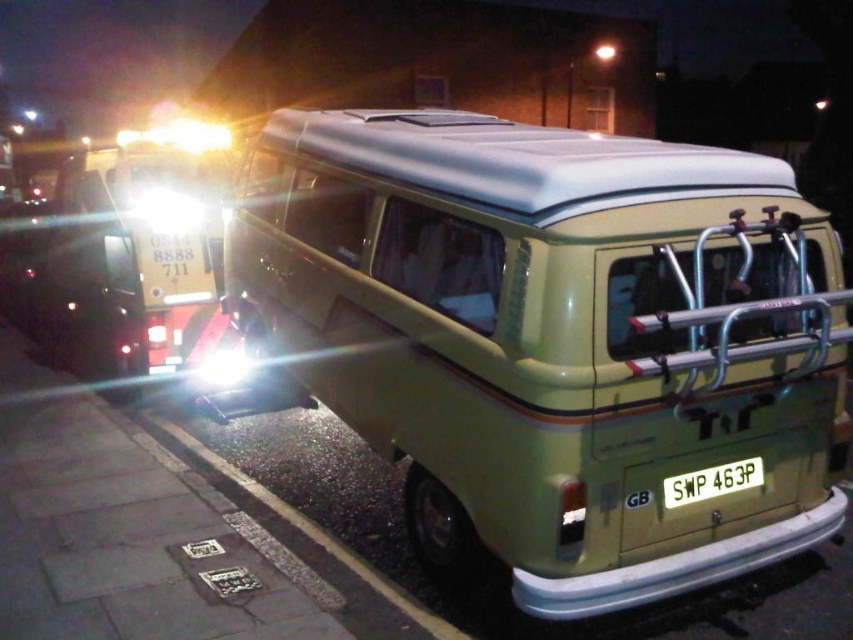
Question: Which of the following is the closest to the observer?

Choices:
 (A) (706, 483)
 (B) (144, 225)
 (C) (486, 417)

Answer: (C)

Question: Can you confirm if matte green van at center is positioned to the left of matte white headlight at upper left?

Choices:
 (A) yes
 (B) no

Answer: (B)

Question: Which point appears closest to the camera in this image?

Choices:
 (A) (573, 468)
 (B) (729, 481)

Answer: (A)

Question: Can you confirm if white plastic license plate at center is thinner than matte white headlight at upper left?

Choices:
 (A) yes
 (B) no

Answer: (A)

Question: Can you confirm if matte green van at center is bigger than white plastic license plate at center?

Choices:
 (A) yes
 (B) no

Answer: (A)

Question: Estimate the real-world distances between objects in this image. Which object is farther from the white plastic license plate at center?

Choices:
 (A) matte white headlight at upper left
 (B) matte green van at center

Answer: (A)